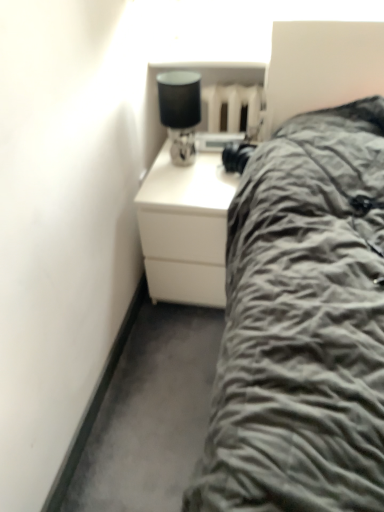
Question: Is point (206, 173) positioned closer to the camera than point (180, 126)?

Choices:
 (A) farther
 (B) closer

Answer: (A)

Question: Considering their positions, is white matte chest of drawers at center located in front of or behind matte black lampshade at upper right?

Choices:
 (A) behind
 (B) front

Answer: (A)

Question: Visually, is white matte chest of drawers at center positioned to the left or to the right of matte black lampshade at upper right?

Choices:
 (A) right
 (B) left

Answer: (A)

Question: Looking at the image, does matte black lampshade at upper right seem bigger or smaller compared to white matte chest of drawers at center?

Choices:
 (A) small
 (B) big

Answer: (A)

Question: Is matte black lampshade at upper right taller or shorter than white matte chest of drawers at center?

Choices:
 (A) tall
 (B) short

Answer: (B)

Question: In the image, is matte black lampshade at upper right positioned in front of or behind white matte chest of drawers at center?

Choices:
 (A) behind
 (B) front

Answer: (B)

Question: Would you say matte black lampshade at upper right is to the left or to the right of white matte chest of drawers at center in the picture?

Choices:
 (A) left
 (B) right

Answer: (A)